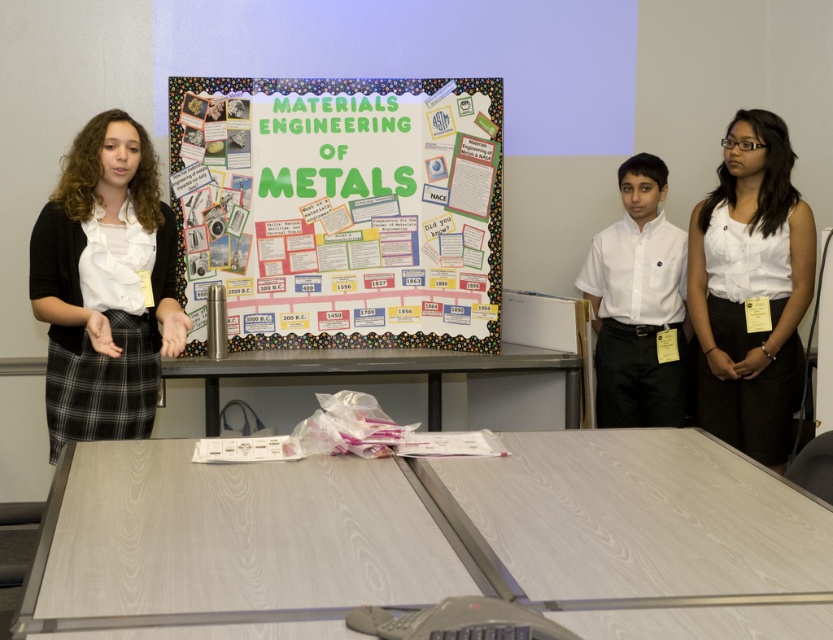
Does multicolored paperboard at center have a greater width compared to matte black skirt at left?

Indeed, multicolored paperboard at center has a greater width compared to matte black skirt at left.

Does point (297, 225) come behind point (92, 332)?

Yes, point (297, 225) is farther from viewer.

At what (x,y) coordinates should I click in order to perform the action: click on multicolored paperboard at center. Please return your answer as a coordinate pair (x, y). The width and height of the screenshot is (833, 640). Looking at the image, I should click on (352, 212).

Can you confirm if multicolored paperboard at center is wider than white smooth shirt at center?

Yes.

What are the coordinates of `multicolored paperboard at center` in the screenshot? It's located at (352, 212).

Between light wood table at center and metallic gray table at center, which one has more height?

With more height is metallic gray table at center.

Who is more forward, (671, 564) or (307, 353)?

Point (671, 564)

At what (x,y) coordinates should I click in order to perform the action: click on light wood table at center. Please return your answer as a coordinate pair (x, y). Looking at the image, I should click on (432, 538).

The height and width of the screenshot is (640, 833). In order to click on light wood table at center in this screenshot , I will do `click(432, 538)`.